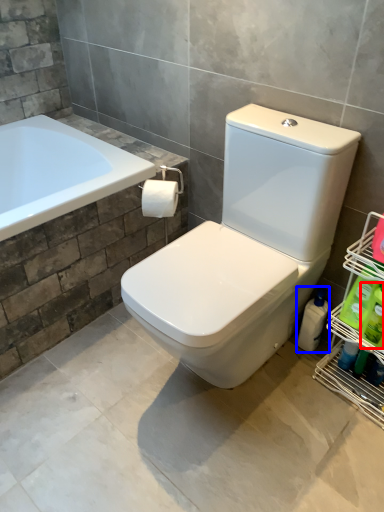
Question: Which object is closer to the camera taking this photo, cleaning product (highlighted by a red box) or cleaning product (highlighted by a blue box)?

Choices:
 (A) cleaning product
 (B) cleaning product

Answer: (A)